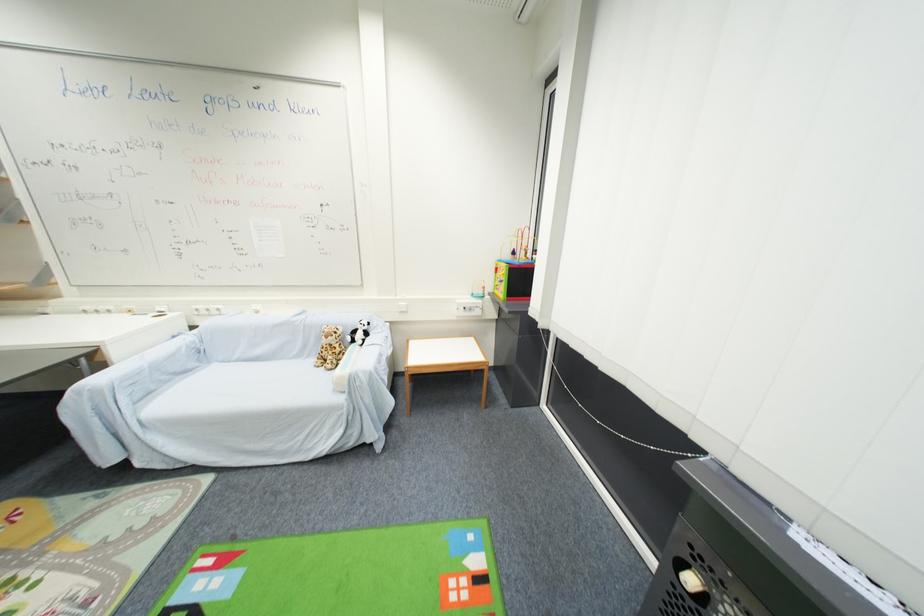
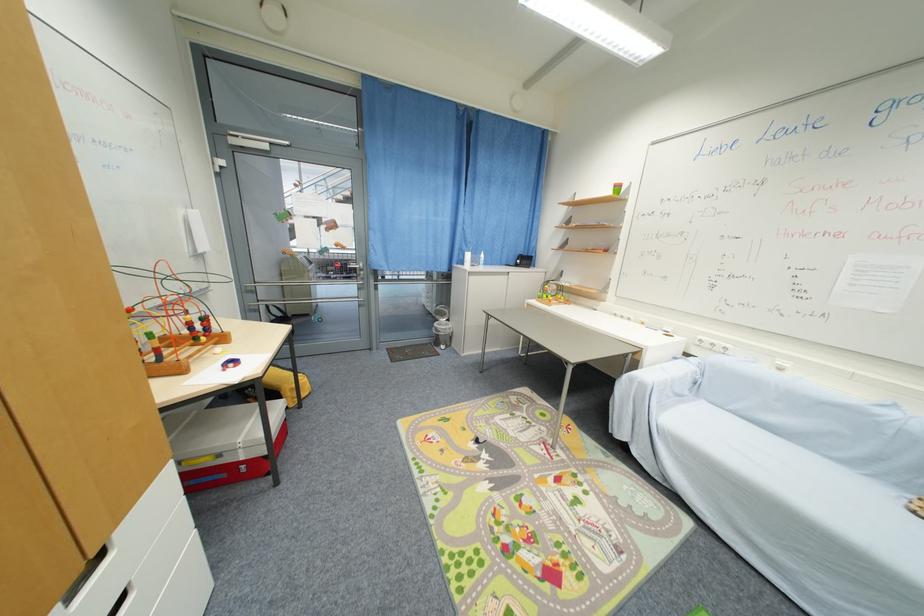
Find the pixel in the second image that matches (x=262, y=314) in the first image.

(785, 371)